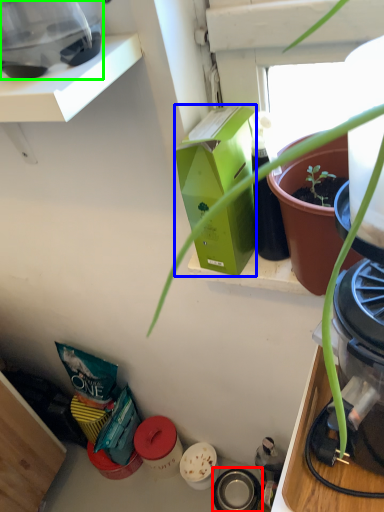
Question: Which is nearer to the appliance (highlighted by a red box)? box (highlighted by a blue box) or appliance (highlighted by a green box).

Choices:
 (A) box
 (B) appliance

Answer: (A)